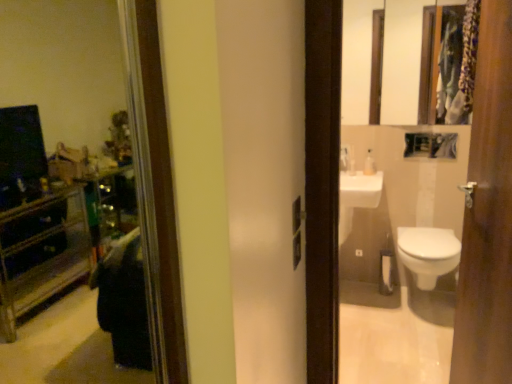
Where is `white glossy soap dispenser at upper center`? This screenshot has width=512, height=384. white glossy soap dispenser at upper center is located at coordinates (369, 164).

What do you see at coordinates (488, 214) in the screenshot? The width and height of the screenshot is (512, 384). I see `wooden door at right` at bounding box center [488, 214].

Where is `white glossy toilet at lower right`? This screenshot has height=384, width=512. white glossy toilet at lower right is located at coordinates (428, 253).

Is point (429, 248) farther from camera compared to point (372, 165)?

No, (429, 248) is in front of (372, 165).

From the image's perspective, is white glossy toilet at lower right below white glossy soap dispenser at upper center?

Yes, from the image's perspective, white glossy toilet at lower right is below white glossy soap dispenser at upper center.

Is white glossy toilet at lower right looking in the opposite direction of white glossy soap dispenser at upper center?

No.

Considering the sizes of objects white glossy toilet at lower right and white glossy soap dispenser at upper center in the image provided, who is thinner, white glossy toilet at lower right or white glossy soap dispenser at upper center?

white glossy soap dispenser at upper center is thinner.

Is white glossy soap dispenser at upper center oriented away from wooden framed mirror at upper right?

No, white glossy soap dispenser at upper center is not facing the opposite direction of wooden framed mirror at upper right.

Is white glossy soap dispenser at upper center directly adjacent to wooden framed mirror at upper right?

They are not placed beside each other.

How much distance is there between white glossy soap dispenser at upper center and wooden framed mirror at upper right?

white glossy soap dispenser at upper center is 5.85 feet away from wooden framed mirror at upper right.

This screenshot has width=512, height=384. There is a white glossy soap dispenser at upper center. What are the coordinates of `mirror above it (from a real-world perspective)` in the screenshot? It's located at (383, 59).

From a real-world perspective, is wooden door at right physically above white glossy soap dispenser at upper center?

Actually, wooden door at right is physically below white glossy soap dispenser at upper center in the real world.

Between wooden door at right and white glossy soap dispenser at upper center, which one has smaller width?

Thinner between the two is white glossy soap dispenser at upper center.

Can you confirm if wooden door at right is taller than white glossy soap dispenser at upper center?

Yes, wooden door at right is taller than white glossy soap dispenser at upper center.

From the image's perspective, which object appears higher, wooden door at right or white glossy soap dispenser at upper center?

white glossy soap dispenser at upper center.

From a real-world perspective, is white glossy toilet at lower right over wooden framed mirror at upper right?

Incorrect, from a real-world perspective, white glossy toilet at lower right is lower than wooden framed mirror at upper right.

Who is bigger, white glossy toilet at lower right or wooden framed mirror at upper right?

With larger size is white glossy toilet at lower right.

Can you confirm if white glossy toilet at lower right is thinner than wooden framed mirror at upper right?

In fact, white glossy toilet at lower right might be wider than wooden framed mirror at upper right.

Does white glossy toilet at lower right appear on the left side of wooden framed mirror at upper right?

No, white glossy toilet at lower right is not to the left of wooden framed mirror at upper right.

Based on the photo, is wooden door at right next to white glossy toilet at lower right and touching it?

No, wooden door at right is not with white glossy toilet at lower right.

The width and height of the screenshot is (512, 384). Identify the location of toilet located below the wooden door at right (from the image's perspective). (428, 253).

Which is behind, point (505, 242) or point (408, 263)?

The point (408, 263) is farther.

Does point (364, 173) come behind point (428, 265)?

Yes, it is.

Considering the sizes of white glossy soap dispenser at upper center and white glossy toilet at lower right in the image, is white glossy soap dispenser at upper center bigger or smaller than white glossy toilet at lower right?

Considering their sizes, white glossy soap dispenser at upper center takes up less space than white glossy toilet at lower right.

In the scene shown: Can you confirm if white glossy soap dispenser at upper center is wider than white glossy toilet at lower right?

Incorrect, the width of white glossy soap dispenser at upper center does not surpass that of white glossy toilet at lower right.

From a real-world perspective, is white glossy soap dispenser at upper center positioned over white glossy toilet at lower right based on gravity?

Indeed, from a real-world perspective, white glossy soap dispenser at upper center stands above white glossy toilet at lower right.

Can you confirm if wooden framed mirror at upper right is taller than white glossy soap dispenser at upper center?

Indeed, wooden framed mirror at upper right has a greater height compared to white glossy soap dispenser at upper center.

Is point (349, 41) behind point (367, 159)?

Yes, it is behind point (367, 159).

From a real-world perspective, who is located lower, wooden framed mirror at upper right or white glossy soap dispenser at upper center?

From a 3D spatial view, white glossy soap dispenser at upper center is below.

Does wooden framed mirror at upper right turn towards white glossy soap dispenser at upper center?

No, wooden framed mirror at upper right is not aimed at white glossy soap dispenser at upper center.

What are the coordinates of `toilet on the right of white glossy soap dispenser at upper center` in the screenshot? It's located at (428, 253).

Where is `mirror in front of the white glossy soap dispenser at upper center`? mirror in front of the white glossy soap dispenser at upper center is located at coordinates (383, 59).

When comparing their distances from wooden framed mirror at upper right, does wooden door at right or white glossy soap dispenser at upper center seem closer?

white glossy soap dispenser at upper center lies closer to wooden framed mirror at upper right than the other object.

Estimate the real-world distances between objects in this image. Which object is further from wooden door at right, wooden framed mirror at upper right or white glossy soap dispenser at upper center?

The object further to wooden door at right is wooden framed mirror at upper right.

From the image, which object appears to be nearer to wooden framed mirror at upper right, white glossy soap dispenser at upper center or wooden door at right?

Among the two, white glossy soap dispenser at upper center is located nearer to wooden framed mirror at upper right.

Based on their spatial positions, is white glossy toilet at lower right or wooden framed mirror at upper right closer to wooden door at right?

white glossy toilet at lower right is positioned closer to the anchor wooden door at right.

When comparing their distances from white glossy toilet at lower right, does wooden door at right or wooden framed mirror at upper right seem further?

Based on the image, wooden framed mirror at upper right appears to be further to white glossy toilet at lower right.

When comparing their distances from white glossy toilet at lower right, does wooden framed mirror at upper right or wooden door at right seem closer?

wooden door at right lies closer to white glossy toilet at lower right than the other object.

Based on their spatial positions, is wooden framed mirror at upper right or white glossy soap dispenser at upper center closer to white glossy toilet at lower right?

white glossy soap dispenser at upper center is closer to white glossy toilet at lower right.

Estimate the real-world distances between objects in this image. Which object is further from wooden door at right, white glossy soap dispenser at upper center or white glossy toilet at lower right?

white glossy soap dispenser at upper center is positioned further to the anchor wooden door at right.

You are a GUI agent. You are given a task and a screenshot of the screen. Output one action in this format:
    pyautogui.click(x=<x>, y=<y>)
    Task: Click on the toilet located between wooden door at right and wooden framed mirror at upper right in the depth direction
    
    Given the screenshot: What is the action you would take?
    pyautogui.click(x=428, y=253)

Identify the location of mirror between wooden door at right and white glossy soap dispenser at upper center in the front-back direction. This screenshot has height=384, width=512. (383, 59).

Find the location of a particular element. Image resolution: width=512 pixels, height=384 pixels. toiletry between wooden framed mirror at upper right and white glossy toilet at lower right in the vertical direction is located at coordinates (369, 164).

Locate an element on the screen. This screenshot has height=384, width=512. toilet positioned between wooden door at right and white glossy soap dispenser at upper center from near to far is located at coordinates (428, 253).